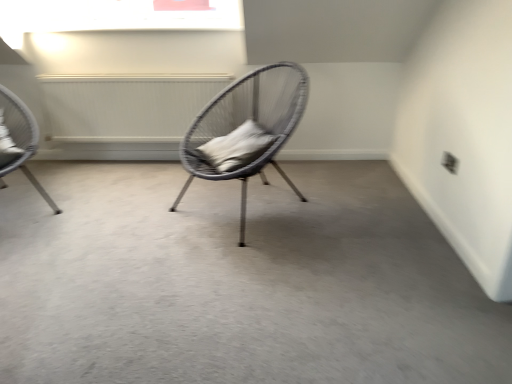
Question: Is white textured radiator at upper left situated inside smooth gray carpet at center or outside?

Choices:
 (A) outside
 (B) inside

Answer: (A)

Question: In terms of size, does white textured radiator at upper left appear bigger or smaller than smooth gray carpet at center?

Choices:
 (A) small
 (B) big

Answer: (A)

Question: Which of these objects is positioned closest to the white textured radiator at upper left?

Choices:
 (A) matte wicker chair at left, which is counted as the 1th chair, starting from the left
 (B) gray fabric pillow at center
 (C) smooth gray carpet at center
 (D) woven grey chair at center, which appears as the 1th chair when viewed from the right

Answer: (A)

Question: Estimate the real-world distances between objects in this image. Which object is closer to the woven grey chair at center, which appears as the 1th chair when viewed from the right?

Choices:
 (A) white textured radiator at upper left
 (B) matte wicker chair at left, the 2th chair when ordered from right to left
 (C) gray fabric pillow at center
 (D) smooth gray carpet at center

Answer: (C)